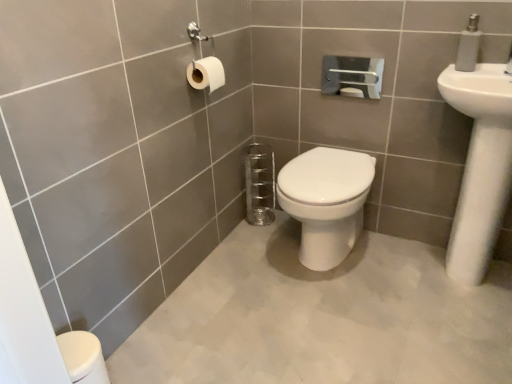
At what (x,y) coordinates should I click in order to perform the action: click on empty space that is ontop of white glossy toilet at center (from a real-world perspective). Please return your answer as a coordinate pair (x, y). The image size is (512, 384). Looking at the image, I should click on (329, 156).